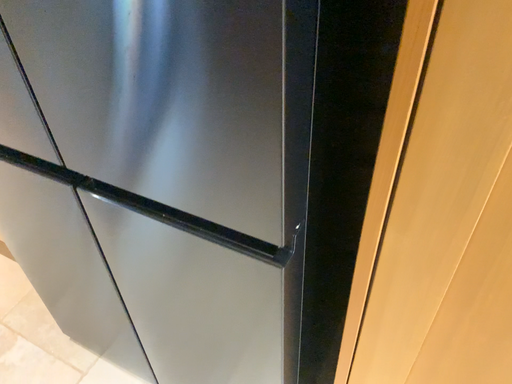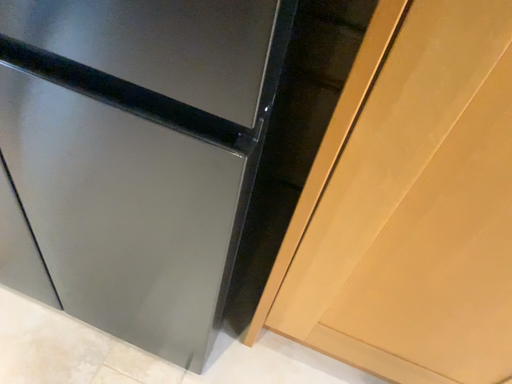
Question: How did the camera likely rotate when shooting the video?

Choices:
 (A) rotated left
 (B) rotated right

Answer: (B)